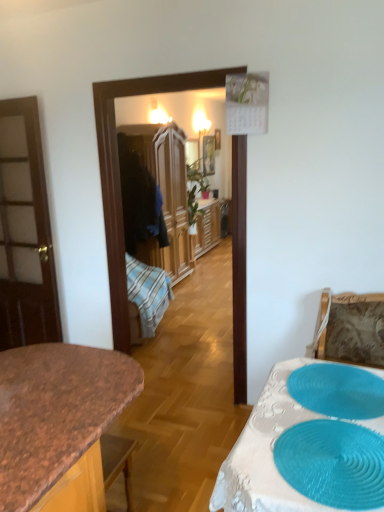
Question: Is blue textured placemat at lower right, which ranks as the first oval in back-to-front order, shorter than teal rubber placemat at lower right, which appears as the 1th oval when viewed from the front?

Choices:
 (A) no
 (B) yes

Answer: (B)

Question: Does blue textured placemat at lower right, which ranks as the first oval in back-to-front order, have a lesser width compared to teal rubber placemat at lower right, arranged as the 2th oval when viewed from the back?

Choices:
 (A) no
 (B) yes

Answer: (B)

Question: Does blue textured placemat at lower right, which ranks as the first oval in back-to-front order, lie behind teal rubber placemat at lower right, arranged as the 2th oval when viewed from the back?

Choices:
 (A) yes
 (B) no

Answer: (A)

Question: Is the depth of blue textured placemat at lower right, marked as the 2th oval in a front-to-back arrangement, less than that of teal rubber placemat at lower right, arranged as the 2th oval when viewed from the back?

Choices:
 (A) no
 (B) yes

Answer: (A)

Question: Considering the relative sizes of blue textured placemat at lower right, which ranks as the first oval in back-to-front order, and teal rubber placemat at lower right, which appears as the 1th oval when viewed from the front, in the image provided, is blue textured placemat at lower right, which ranks as the first oval in back-to-front order, bigger than teal rubber placemat at lower right, which appears as the 1th oval when viewed from the front,?

Choices:
 (A) yes
 (B) no

Answer: (B)

Question: Is blue textured placemat at lower right, which ranks as the first oval in back-to-front order, at the left side of teal rubber placemat at lower right, arranged as the 2th oval when viewed from the back?

Choices:
 (A) yes
 (B) no

Answer: (B)

Question: Does white lace tablecloth at lower right have a smaller size compared to wooden picture frame at center?

Choices:
 (A) no
 (B) yes

Answer: (A)

Question: Does white lace tablecloth at lower right appear on the left side of wooden picture frame at center?

Choices:
 (A) yes
 (B) no

Answer: (B)

Question: Is white lace tablecloth at lower right wider than wooden picture frame at center?

Choices:
 (A) yes
 (B) no

Answer: (A)

Question: From a real-world perspective, is white lace tablecloth at lower right positioned over wooden picture frame at center based on gravity?

Choices:
 (A) no
 (B) yes

Answer: (A)

Question: Is white lace tablecloth at lower right taller than wooden picture frame at center?

Choices:
 (A) no
 (B) yes

Answer: (A)

Question: Would you consider white lace tablecloth at lower right to be distant from wooden picture frame at center?

Choices:
 (A) yes
 (B) no

Answer: (A)

Question: From a real-world perspective, does wooden wardrobe at center stand above granite countertop at center?

Choices:
 (A) yes
 (B) no

Answer: (A)